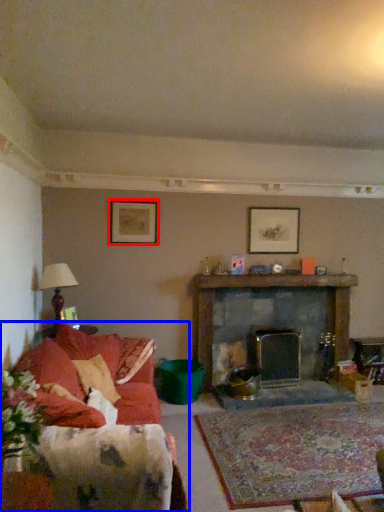
Question: Which object is closer to the camera taking this photo, picture frame (highlighted by a red box) or studio couch (highlighted by a blue box)?

Choices:
 (A) picture frame
 (B) studio couch

Answer: (B)